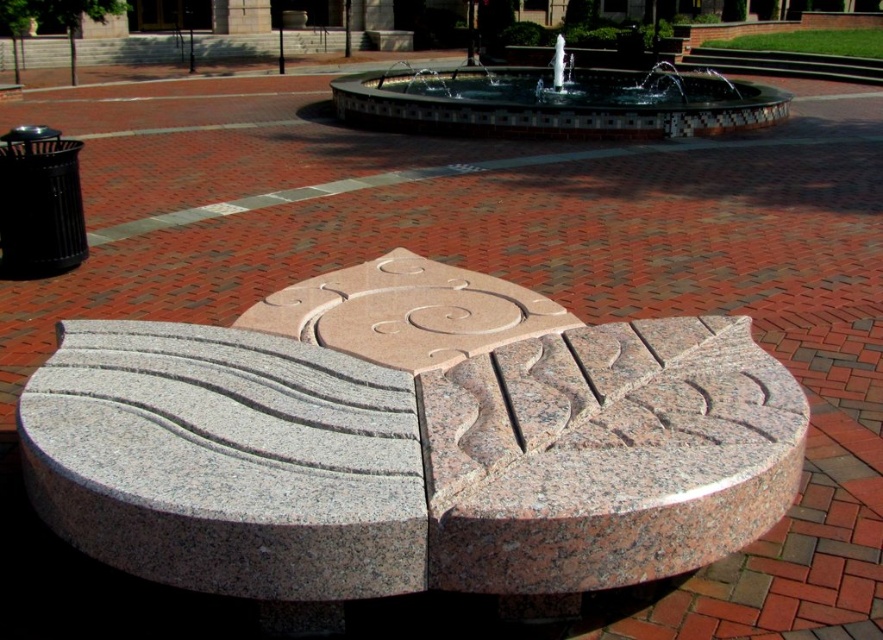
Question: Is granite sculpture at center to the left of polished mosaic water at upper center from the viewer's perspective?

Choices:
 (A) no
 (B) yes

Answer: (B)

Question: Can you confirm if granite sculpture at center is bigger than polished mosaic water at upper center?

Choices:
 (A) no
 (B) yes

Answer: (A)

Question: Can you confirm if granite sculpture at center is bigger than polished mosaic water at upper center?

Choices:
 (A) yes
 (B) no

Answer: (B)

Question: Which point appears farthest from the camera in this image?

Choices:
 (A) (455, 88)
 (B) (455, 577)

Answer: (A)